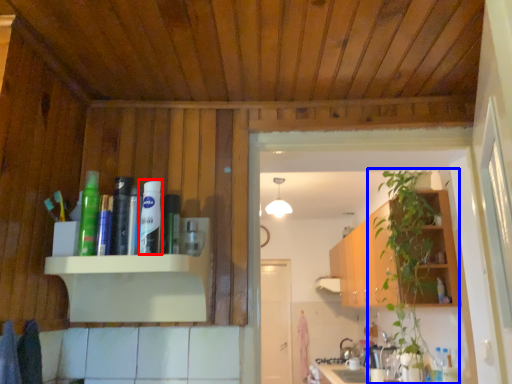
Question: Among these objects, which one is nearest to the camera, toiletry (highlighted by a red box) or houseplant (highlighted by a blue box)?

Choices:
 (A) toiletry
 (B) houseplant

Answer: (A)